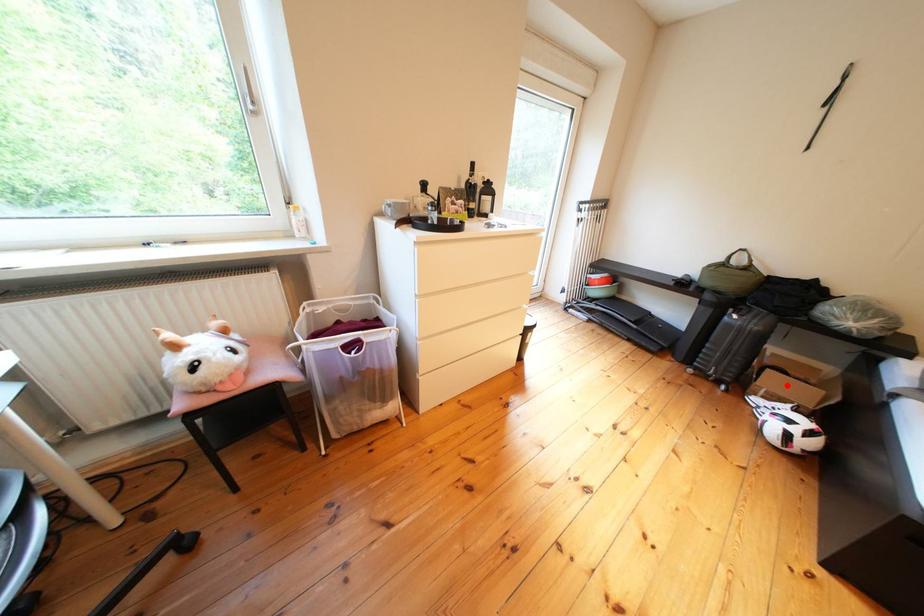
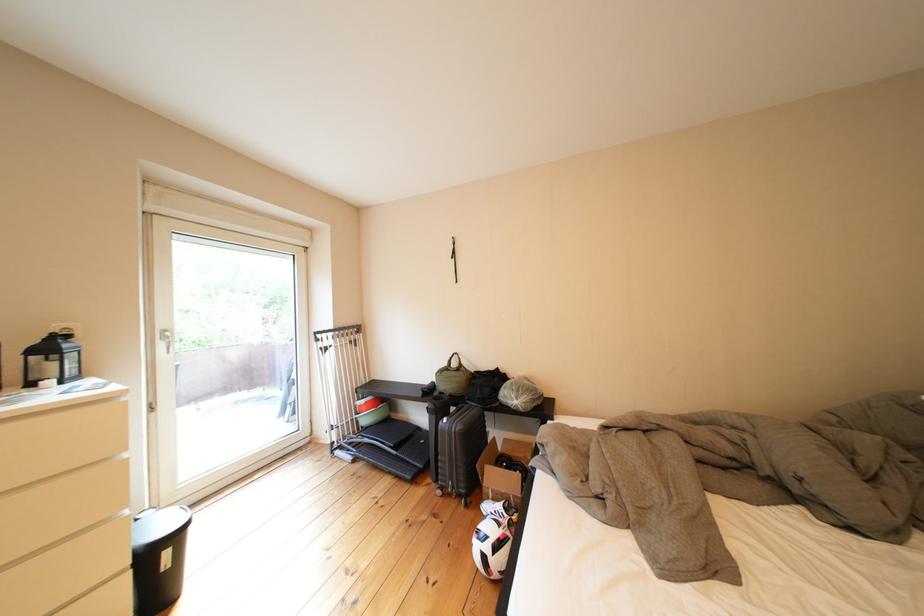
Find the pixel in the second image that matches the highlighted location in the first image.

(505, 480)